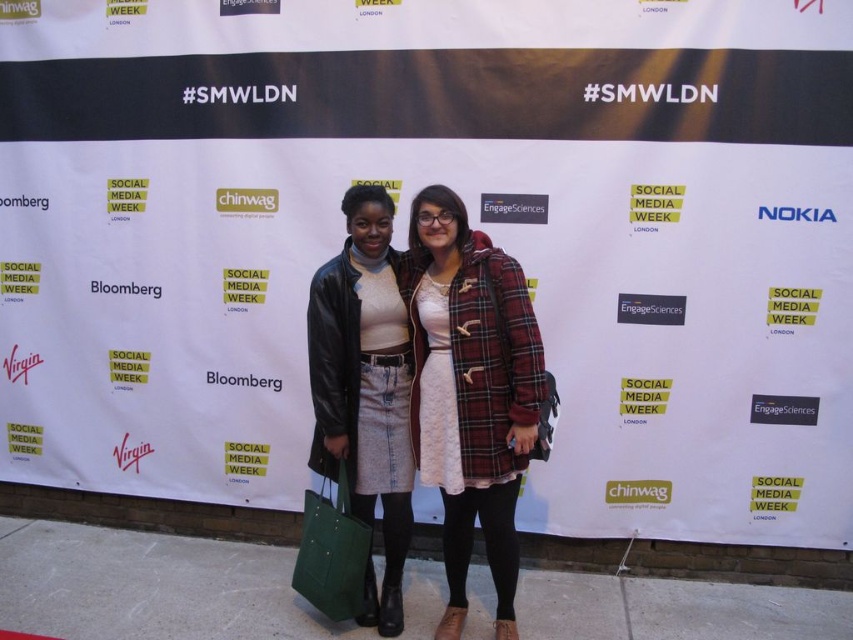
Question: Which object appears closest to the camera in this image?

Choices:
 (A) matte black jacket at center
 (B) green fabric tote at lower center
 (C) plaid wool coat at center

Answer: (C)

Question: Which object is farther from the camera taking this photo?

Choices:
 (A) plaid wool coat at center
 (B) matte black jacket at center

Answer: (B)

Question: Can you confirm if plaid wool coat at center is positioned above matte black jacket at center?

Choices:
 (A) no
 (B) yes

Answer: (B)

Question: Is plaid wool coat at center below matte black jacket at center?

Choices:
 (A) no
 (B) yes

Answer: (A)

Question: Which object appears farthest from the camera in this image?

Choices:
 (A) green fabric tote at lower center
 (B) plaid wool coat at center

Answer: (A)

Question: Can you confirm if plaid wool coat at center is positioned above green fabric tote at lower center?

Choices:
 (A) yes
 (B) no

Answer: (A)